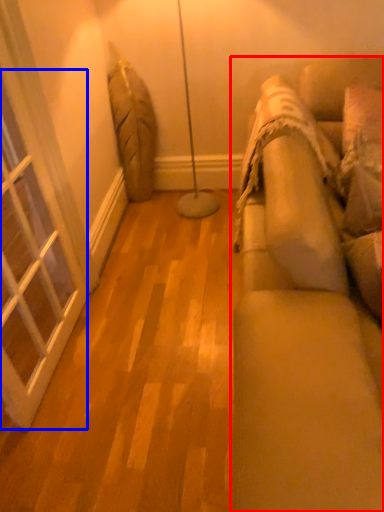
Question: Which object appears farthest to the camera in this image, studio couch (highlighted by a red box) or window (highlighted by a blue box)?

Choices:
 (A) studio couch
 (B) window

Answer: (B)